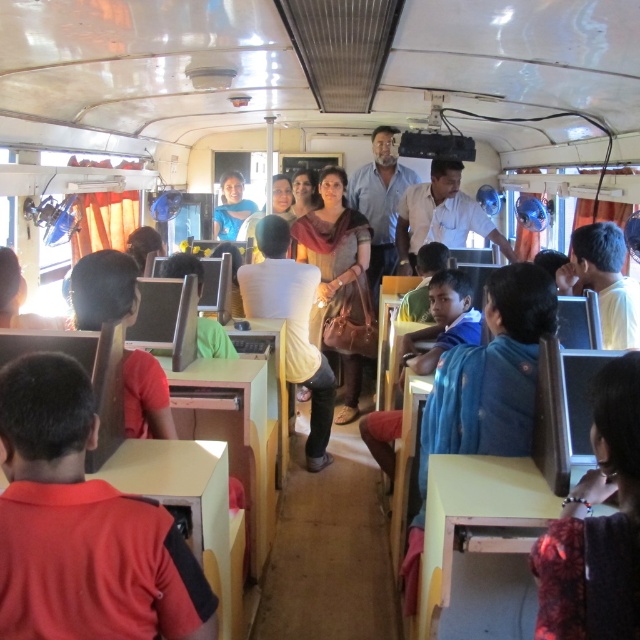
You are sitting in the computer lab inside a vehicle. You need to reach the blue fabric coach at center to grab a bag. Is the dark red fabric at center blocking your path? Please explain.

The dark red fabric at center is closer to the viewer than the blue fabric coach at center, so it is blocking the path to the blue fabric coach at center.

You are a passenger in the vehicle and you see the red matte shirt at lower left and the dark red fabric at center. Which one is closer to the floor?

The red matte shirt at lower left is located below dark red fabric at center, so it is closer to the floor.